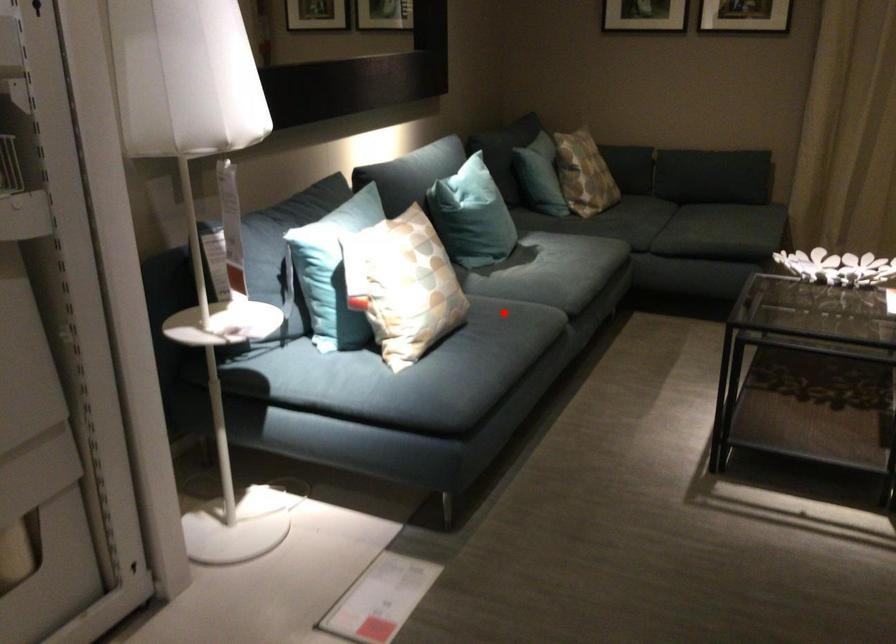
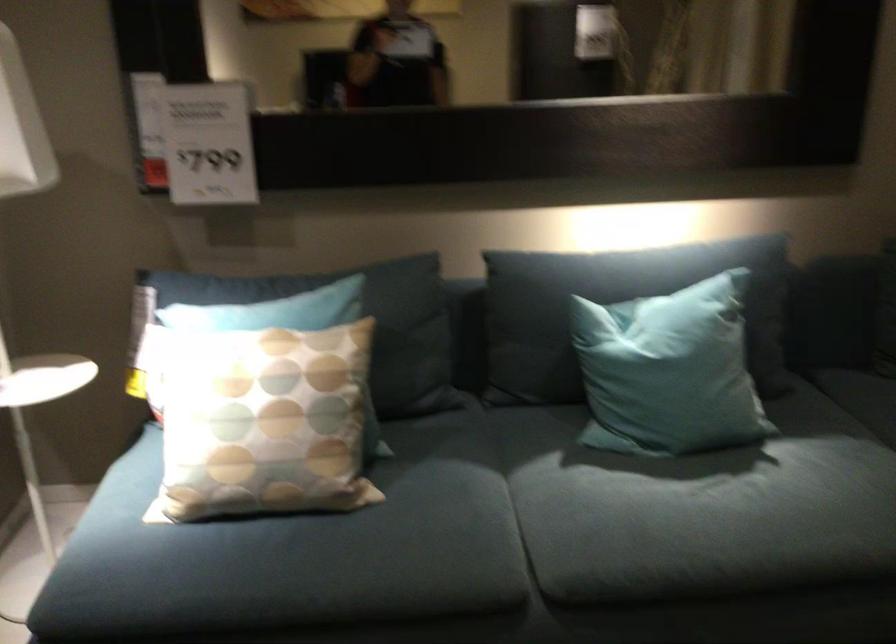
Question: I am providing you with two images of the same scene from different viewpoints. A red point is marked on the first image. At the location where the point appears in image 1, is it still visible in image 2?

Choices:
 (A) Yes
 (B) No

Answer: (A)